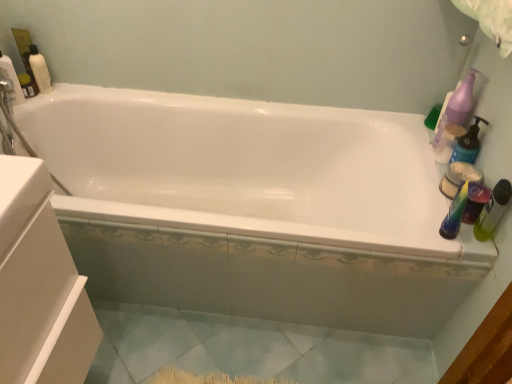
At what (x,y) coordinates should I click in order to perform the action: click on spots to the right of matte white bottle at upper left, the 1th cleaning product viewed from the top. Please return your answer as a coordinate pair (x, y). Looking at the image, I should click on (76, 90).